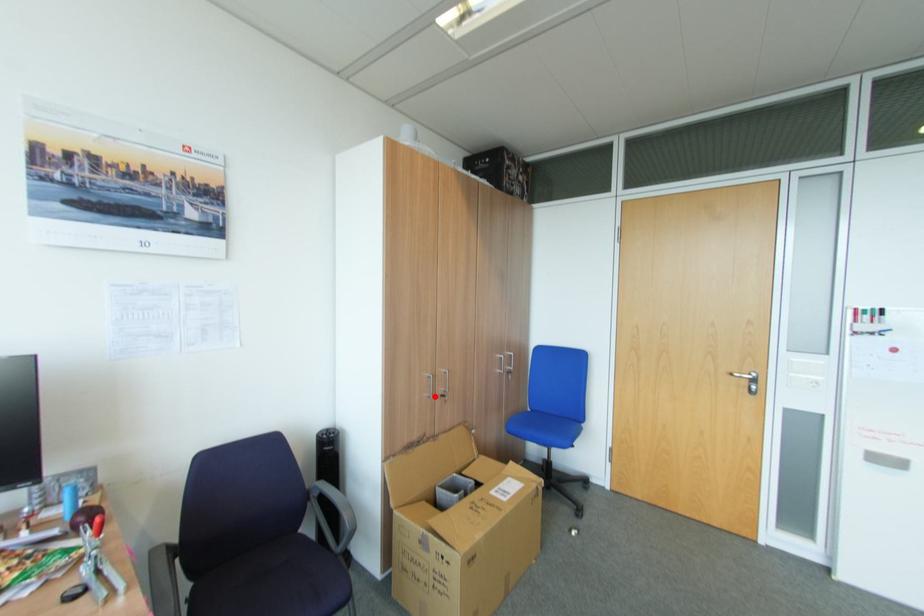
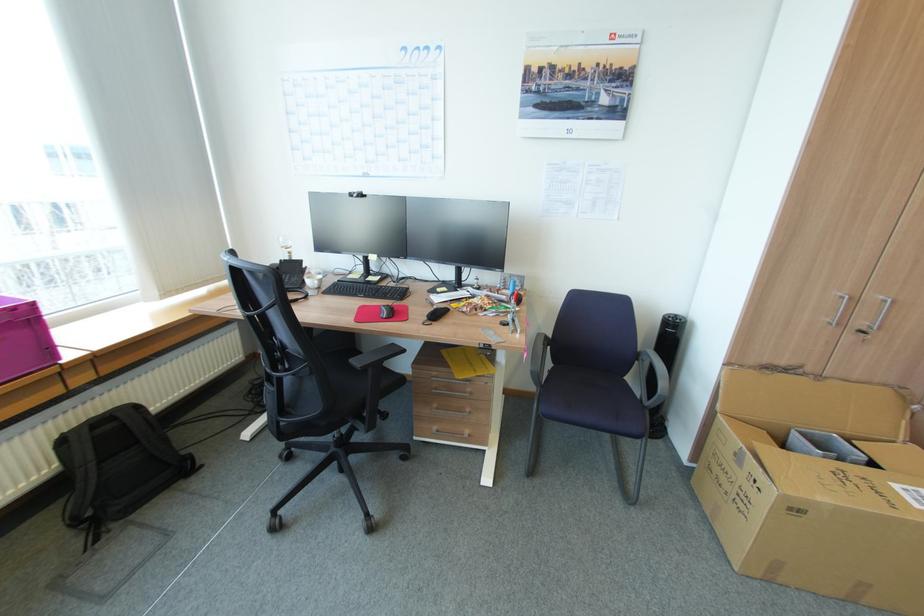
The point at the highlighted location is marked in the first image. Where is the corresponding point in the second image?

(833, 323)